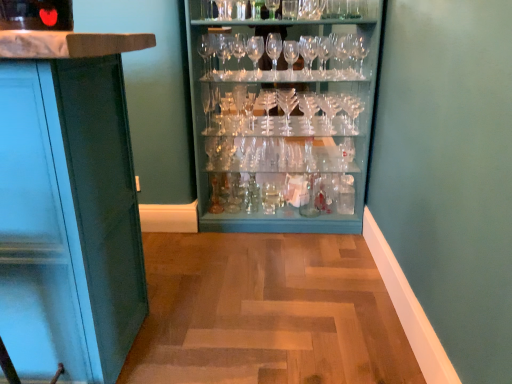
The image size is (512, 384). Describe the element at coordinates (282, 112) in the screenshot. I see `clear glassware at center` at that location.

Identify the location of clear glassware at center. This screenshot has width=512, height=384. (282, 112).

In order to face clear glassware at center, should I rotate leftwards or rightwards?

To align with it, rotate right about 3.530°.

Measure the distance between matte teal cabinet at left and camera.

matte teal cabinet at left and camera are 86.64 centimeters apart from each other.

The height and width of the screenshot is (384, 512). Describe the element at coordinates (68, 206) in the screenshot. I see `matte teal cabinet at left` at that location.

Where is `matte teal cabinet at left`? This screenshot has width=512, height=384. matte teal cabinet at left is located at coordinates (68, 206).

The image size is (512, 384). Find the location of `clear glassware at center`. clear glassware at center is located at coordinates (282, 112).

Can you confirm if matte teal cabinet at left is positioned to the right of clear glassware at center?

Incorrect, matte teal cabinet at left is not on the right side of clear glassware at center.

Considering their positions, is matte teal cabinet at left located in front of or behind clear glassware at center?

Visually, matte teal cabinet at left is located in front of clear glassware at center.

Considering the points (110, 213) and (265, 124), which point is in front, point (110, 213) or point (265, 124)?

The point (110, 213) is closer to the camera.

From the image's perspective, which is below, matte teal cabinet at left or clear glassware at center?

matte teal cabinet at left is shown below in the image.

From a real-world perspective, is matte teal cabinet at left located beneath clear glassware at center?

Yes, from a real-world perspective, matte teal cabinet at left is beneath clear glassware at center.

Considering the relative sizes of matte teal cabinet at left and clear glassware at center in the image provided, is matte teal cabinet at left wider than clear glassware at center?

Yes, matte teal cabinet at left is wider than clear glassware at center.

Can you confirm if matte teal cabinet at left is taller than clear glassware at center?

No, matte teal cabinet at left is not taller than clear glassware at center.

Who is bigger, matte teal cabinet at left or clear glassware at center?

clear glassware at center is bigger.

Does matte teal cabinet at left contain clear glassware at center?

No.

Is there a large distance between matte teal cabinet at left and clear glassware at center?

Yes, matte teal cabinet at left and clear glassware at center are located far from each other.

Is matte teal cabinet at left facing away from clear glassware at center?

No.

Identify the location of cupboard that appears above the matte teal cabinet at left (from a real-world perspective). The height and width of the screenshot is (384, 512). (282, 112).

Is clear glassware at center to the left or to the right of matte teal cabinet at left in the image?

Clearly, clear glassware at center is on the right of matte teal cabinet at left in the image.

Considering the relative positions of clear glassware at center and matte teal cabinet at left in the image provided, is clear glassware at center in front of matte teal cabinet at left?

No, clear glassware at center is further to the viewer.

Is point (214, 127) more distant than point (67, 285)?

Yes, point (214, 127) is farther from viewer.

Based on the photo, from the image's perspective, relative to matte teal cabinet at left, is clear glassware at center above or below?

Clearly, from the image's perspective, clear glassware at center is above matte teal cabinet at left.

From a real-world perspective, is clear glassware at center under matte teal cabinet at left?

No, from a real-world perspective, clear glassware at center is not below matte teal cabinet at left.

Can you confirm if clear glassware at center is wider than matte teal cabinet at left?

No.

Considering the relative sizes of clear glassware at center and matte teal cabinet at left in the image provided, is clear glassware at center taller than matte teal cabinet at left?

Indeed, clear glassware at center has a greater height compared to matte teal cabinet at left.

Which of these two, clear glassware at center or matte teal cabinet at left, is smaller?

Smaller between the two is matte teal cabinet at left.

Is clear glassware at center situated inside matte teal cabinet at left or outside?

clear glassware at center is spatially situated outside matte teal cabinet at left.

Is clear glassware at center not near matte teal cabinet at left?

Indeed, clear glassware at center is not near matte teal cabinet at left.

Based on the photo, is matte teal cabinet at left at the back of clear glassware at center?

No, matte teal cabinet at left is not at the back of clear glassware at center.

The width and height of the screenshot is (512, 384). I want to click on cabinetry that is under the clear glassware at center (from a real-world perspective), so click(68, 206).

Find the location of `cabinetry that appears in front of the clear glassware at center`. cabinetry that appears in front of the clear glassware at center is located at coordinates (68, 206).

Image resolution: width=512 pixels, height=384 pixels. Identify the location of cupboard on the right of matte teal cabinet at left. (282, 112).